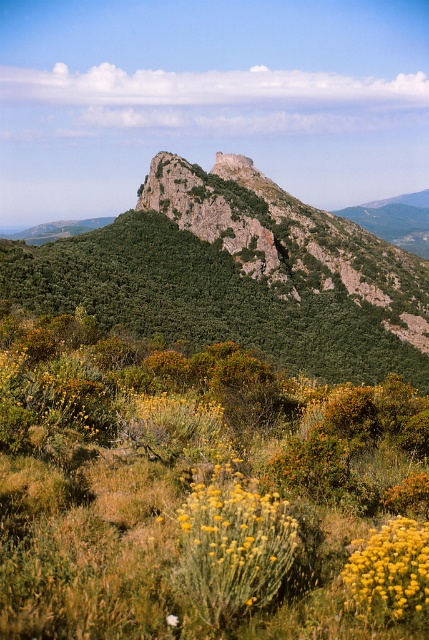
You are a hiker planning to take a photo of the green rocky mountain at upper center and the yellow fluffy bush at lower center. Which object should you focus on first if you want both to be in sharp focus?

The green rocky mountain at upper center is larger than the yellow fluffy bush at lower center, so you should focus on the green rocky mountain at upper center first to ensure both are in sharp focus.

You are standing at the base of the mountain and see the point marked at coordinates (238, 275). What does this point represent in the scene?

The point at coordinates (238, 275) corresponds to the green rocky mountain at upper center.

From the picture: You are a hiker standing at the base of the mountain and see two points marked in the image. Which point is closer to you, point (215, 189) or point (407, 534)?

Point (407, 534) is closer to you because it is less further to the camera than point (215, 189).